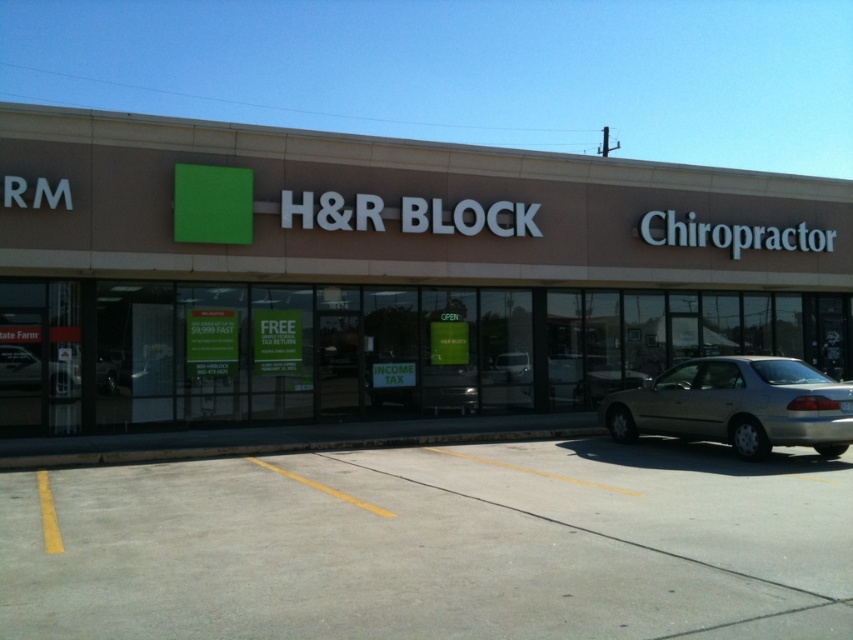
Who is positioned more to the right, brown matte building at center or gold metallic sedan at lower right?

From the viewer's perspective, gold metallic sedan at lower right appears more on the right side.

Does point (653, 296) come behind point (657, 380)?

Yes.

Locate an element on the screen. The width and height of the screenshot is (853, 640). brown matte building at center is located at coordinates pos(381,273).

Is gray concrete parking lot at lower center taller than gold metallic sedan at lower right?

No.

Which of these two, gray concrete parking lot at lower center or gold metallic sedan at lower right, stands shorter?

With less height is gray concrete parking lot at lower center.

Locate an element on the screen. This screenshot has height=640, width=853. gray concrete parking lot at lower center is located at coordinates (434, 545).

Is brown matte building at center to the right of gray concrete parking lot at lower center from the viewer's perspective?

Yes, brown matte building at center is to the right of gray concrete parking lot at lower center.

Which is in front, point (107, 188) or point (548, 552)?

Point (548, 552) is more forward.

Measure the distance between point (15,328) and camera.

The distance of point (15,328) from camera is 13.64 meters.

The width and height of the screenshot is (853, 640). What are the coordinates of `brown matte building at center` in the screenshot? It's located at (381, 273).